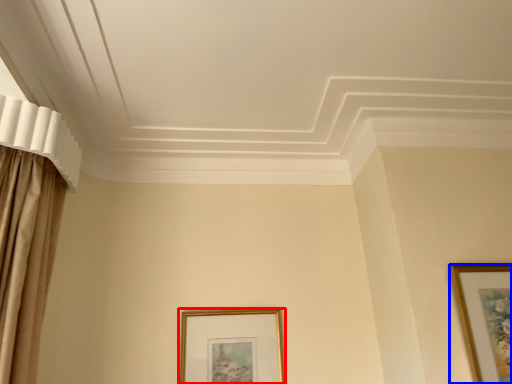
Question: Which object appears closest to the camera in this image, picture frame (highlighted by a red box) or picture frame (highlighted by a blue box)?

Choices:
 (A) picture frame
 (B) picture frame

Answer: (B)